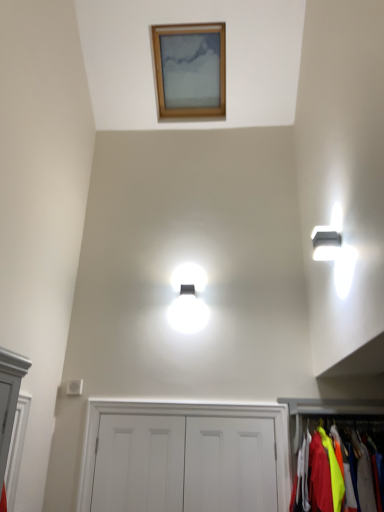
In order to face white matte door at center, which ranks as the first door in right-to-left order, should I rotate leftwards or rightwards?

Turn right approximately 5.450 degrees to face it.

Describe the element at coordinates (190, 70) in the screenshot. The image size is (384, 512). I see `wooden picture frame at upper center` at that location.

Find the location of a particular element. The width and height of the screenshot is (384, 512). neon yellow fabric at lower right, positioned as the second dresser in left-to-right order is located at coordinates (327, 410).

Are white matte door at center, which appears as the 2th door when viewed from the right, and wooden picture frame at upper center located far from each other?

Indeed, white matte door at center, which appears as the 2th door when viewed from the right, is not near wooden picture frame at upper center.

Is white matte door at center, placed as the first door when sorted from left to right, at the right side of wooden picture frame at upper center?

No.

Is point (165, 465) less distant than point (164, 63)?

Yes, it is.

From a real-world perspective, is white matte door at center, placed as the first door when sorted from left to right, above or below wooden picture frame at upper center?

In terms of real-world spatial position, white matte door at center, placed as the first door when sorted from left to right, is below wooden picture frame at upper center.

Find the location of a particular element. The width and height of the screenshot is (384, 512). the 1st door behind the neon yellow fabric at lower right, the first dresser from the right is located at coordinates (230, 464).

Between white matte door at center, positioned as the second door in left-to-right order, and neon yellow fabric at lower right, the first dresser from the right, which one is positioned behind?

white matte door at center, positioned as the second door in left-to-right order, is more distant.

Is white matte door at center, positioned as the second door in left-to-right order, positioned with its back to neon yellow fabric at lower right, positioned as the second dresser in left-to-right order?

white matte door at center, positioned as the second door in left-to-right order, is not turned away from neon yellow fabric at lower right, positioned as the second dresser in left-to-right order.

What's the angular difference between white matte door at center, positioned as the second door in left-to-right order, and neon yellow fabric at lower right, the first dresser from the right,'s facing directions?

They differ by 4.13 degrees in their facing directions.

Which of these two, neon yellow fabric at lower right, positioned as the second dresser in left-to-right order, or wooden picture frame at upper center, stands shorter?

neon yellow fabric at lower right, positioned as the second dresser in left-to-right order, is shorter.

Would you say neon yellow fabric at lower right, the first dresser from the right, is to the left or to the right of wooden picture frame at upper center in the picture?

neon yellow fabric at lower right, the first dresser from the right, is to the right of wooden picture frame at upper center.

Is wooden picture frame at upper center outside of white matte door at center, which ranks as the first door in right-to-left order?

wooden picture frame at upper center lies outside white matte door at center, which ranks as the first door in right-to-left order,'s area.

Is point (163, 61) positioned in front of point (221, 466)?

No, (163, 61) is behind (221, 466).

Between wooden picture frame at upper center and white matte door at center, positioned as the second door in left-to-right order, which one has smaller size?

Smaller between the two is white matte door at center, positioned as the second door in left-to-right order.

Locate an element on the screen. the 1st door directly beneath the wooden picture frame at upper center (from a real-world perspective) is located at coordinates pyautogui.click(x=230, y=464).

In the image, is wooden picture frame at upper center on the left side or the right side of white matte door at center, placed as the first door when sorted from left to right?

Clearly, wooden picture frame at upper center is on the right of white matte door at center, placed as the first door when sorted from left to right, in the image.

Is wooden picture frame at upper center facing towards white matte door at center, which appears as the 2th door when viewed from the right?

No.

From the picture: Which is in front, wooden picture frame at upper center or white matte door at center, placed as the first door when sorted from left to right?

white matte door at center, placed as the first door when sorted from left to right.

From a real-world perspective, is wooden picture frame at upper center located beneath white matte door at center, which appears as the 2th door when viewed from the right?

No, from a real-world perspective, wooden picture frame at upper center is not beneath white matte door at center, which appears as the 2th door when viewed from the right.

Considering the relative sizes of neon yellow fabric at lower right, the first dresser from the right, and white matte door at center, marked as the second dresser in a right-to-left arrangement, in the image provided, is neon yellow fabric at lower right, the first dresser from the right, taller than white matte door at center, marked as the second dresser in a right-to-left arrangement,?

No.

From a real-world perspective, is neon yellow fabric at lower right, the first dresser from the right, on top of white matte door at center, marked as the second dresser in a right-to-left arrangement?

Incorrect, from a real-world perspective, neon yellow fabric at lower right, the first dresser from the right, is lower than white matte door at center, marked as the second dresser in a right-to-left arrangement.

Between neon yellow fabric at lower right, the first dresser from the right, and white matte door at center, marked as the second dresser in a right-to-left arrangement, which one has smaller width?

With smaller width is white matte door at center, marked as the second dresser in a right-to-left arrangement.

How many degrees apart are the facing directions of neon yellow fabric at lower right, the first dresser from the right, and white matte door at center, marked as the second dresser in a right-to-left arrangement?

The angular difference between neon yellow fabric at lower right, the first dresser from the right, and white matte door at center, marked as the second dresser in a right-to-left arrangement, is 4.13 degrees.

From the image's perspective, is white matte door at center, which ranks as the first door in right-to-left order, positioned above or below wooden picture frame at upper center?

Based on their image positions, white matte door at center, which ranks as the first door in right-to-left order, is located beneath wooden picture frame at upper center.

Which is in front, white matte door at center, which ranks as the first door in right-to-left order, or wooden picture frame at upper center?

white matte door at center, which ranks as the first door in right-to-left order, is more forward.

The height and width of the screenshot is (512, 384). I want to click on door that is the 2nd one when counting forward from the wooden picture frame at upper center, so click(x=230, y=464).

Is white matte door at center, which ranks as the first door in right-to-left order, situated inside wooden picture frame at upper center or outside?

white matte door at center, which ranks as the first door in right-to-left order, is spatially situated outside wooden picture frame at upper center.

The height and width of the screenshot is (512, 384). Find the location of `door on the left of wooden picture frame at upper center`. door on the left of wooden picture frame at upper center is located at coordinates (139, 463).

From the image's perspective, count 2nd dressers upward from the white matte door at center, which ranks as the first door in right-to-left order, and point to it. Please provide its 2D coordinates.

[(327, 410)]

Which object lies nearer to the anchor point wooden picture frame at upper center, white matte door at center, which appears as the 2th door when viewed from the right, or white matte door at center, which ranks as the first door in right-to-left order?

white matte door at center, which ranks as the first door in right-to-left order, is positioned closer to the anchor wooden picture frame at upper center.

From the image, which object appears to be farther from white matte door at center, which appears as the 2th door when viewed from the right, wooden picture frame at upper center or neon yellow fabric at lower right, the first dresser from the right?

Based on the image, wooden picture frame at upper center appears to be further to white matte door at center, which appears as the 2th door when viewed from the right.

Looking at the image, which one is located closer to neon yellow fabric at lower right, positioned as the second dresser in left-to-right order, white matte door at center, which ranks as the first door in right-to-left order, or white matte door at center, placed as the first door when sorted from left to right?

Among the two, white matte door at center, which ranks as the first door in right-to-left order, is located nearer to neon yellow fabric at lower right, positioned as the second dresser in left-to-right order.

When comparing their distances from white matte door at center, positioned as the second door in left-to-right order, does wooden picture frame at upper center or white matte door at center, marked as the second dresser in a right-to-left arrangement, seem closer?

white matte door at center, marked as the second dresser in a right-to-left arrangement, is positioned closer to the anchor white matte door at center, positioned as the second door in left-to-right order.

Based on the photo, looking at the image, which one is located closer to white matte door at center, marked as the second dresser in a right-to-left arrangement, neon yellow fabric at lower right, the first dresser from the right, or wooden picture frame at upper center?

Among the two, neon yellow fabric at lower right, the first dresser from the right, is located nearer to white matte door at center, marked as the second dresser in a right-to-left arrangement.

Considering their positions, is neon yellow fabric at lower right, the first dresser from the right, positioned closer to wooden picture frame at upper center than white matte door at center, marked as the second dresser in a right-to-left arrangement?

white matte door at center, marked as the second dresser in a right-to-left arrangement, is closer to wooden picture frame at upper center.

Considering their positions, is white matte door at center, positioned as the second door in left-to-right order, positioned further to neon yellow fabric at lower right, positioned as the second dresser in left-to-right order, than white matte door at center, positioned as the first dresser in left-to-right order?

Among the two, white matte door at center, positioned as the first dresser in left-to-right order, is located further to neon yellow fabric at lower right, positioned as the second dresser in left-to-right order.

From the picture: Considering their positions, is white matte door at center, positioned as the second door in left-to-right order, positioned closer to white matte door at center, marked as the second dresser in a right-to-left arrangement, than wooden picture frame at upper center?

white matte door at center, positioned as the second door in left-to-right order, is positioned closer to the anchor white matte door at center, marked as the second dresser in a right-to-left arrangement.

Image resolution: width=384 pixels, height=512 pixels. I want to click on dresser between white matte door at center, which appears as the 2th door when viewed from the right, and neon yellow fabric at lower right, the first dresser from the right, from left to right, so click(x=184, y=414).

The width and height of the screenshot is (384, 512). What are the coordinates of `door between white matte door at center, which appears as the 2th door when viewed from the right, and neon yellow fabric at lower right, positioned as the second dresser in left-to-right order, from left to right` in the screenshot? It's located at (230, 464).

Where is `door between wooden picture frame at upper center and white matte door at center, which appears as the 2th door when viewed from the right, in the vertical direction`? door between wooden picture frame at upper center and white matte door at center, which appears as the 2th door when viewed from the right, in the vertical direction is located at coordinates (230, 464).

Find the location of a particular element. dresser between wooden picture frame at upper center and white matte door at center, marked as the second dresser in a right-to-left arrangement, from top to bottom is located at coordinates (327, 410).